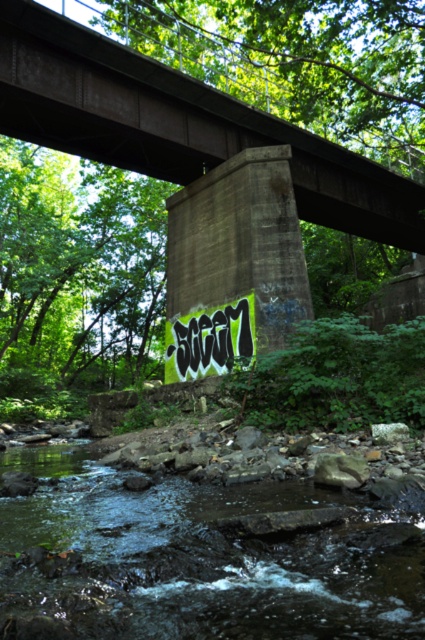
Question: Which object is farther from the camera taking this photo?

Choices:
 (A) concrete at center
 (B) green mossy rock at lower center

Answer: (A)

Question: Which object appears closest to the camera in this image?

Choices:
 (A) concrete at center
 (B) green mossy rock at lower center

Answer: (B)

Question: Is green mossy rock at lower center behind concrete at center?

Choices:
 (A) no
 (B) yes

Answer: (A)

Question: Does green mossy rock at lower center appear under concrete at center?

Choices:
 (A) no
 (B) yes

Answer: (B)

Question: Is green mossy rock at lower center bigger than concrete at center?

Choices:
 (A) yes
 (B) no

Answer: (B)

Question: Which of the following is the farthest from the observer?

Choices:
 (A) (333, 202)
 (B) (252, 509)

Answer: (A)